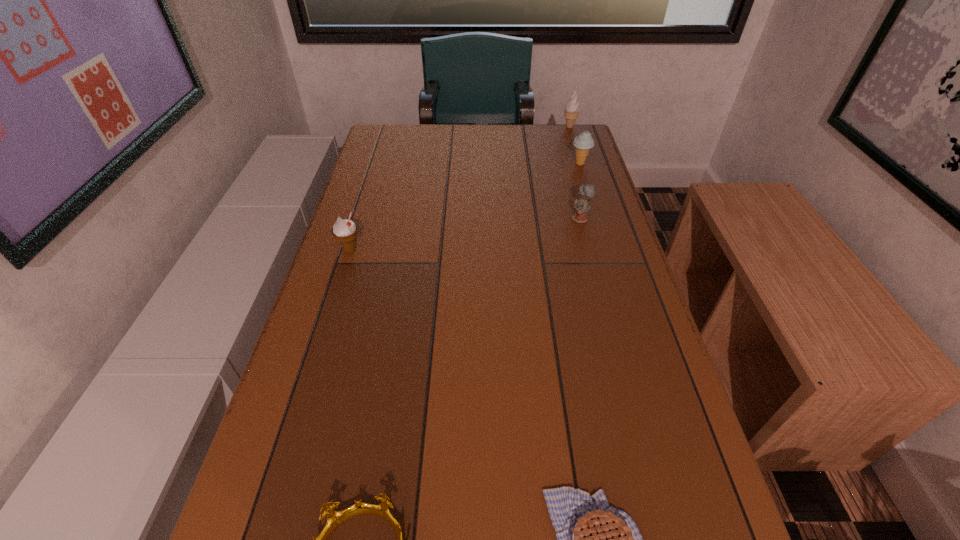
At what (x,y) coordinates should I click in order to perform the action: click on vacant region at the right edge of the desktop. Please return your answer as a coordinate pair (x, y). The image size is (960, 540). Looking at the image, I should click on (655, 429).

The image size is (960, 540). I want to click on blank area at the far left corner, so click(x=375, y=139).

You are a GUI agent. You are given a task and a screenshot of the screen. Output one action in this format:
    pyautogui.click(x=<x>, y=<y>)
    Task: Click on the vacant space that's between the leftmost icecream and the second farthest object
    The width and height of the screenshot is (960, 540).
    Given the screenshot: What is the action you would take?
    pyautogui.click(x=465, y=207)

Identify the location of unoccupied area between the fifth nearest object and the nearest icecream. (465, 207).

This screenshot has width=960, height=540. Find the location of `the third closest object to the pie`. the third closest object to the pie is located at coordinates (344, 230).

Locate an element on the screen. The width and height of the screenshot is (960, 540). the closest object to the nearest icecream is located at coordinates (581, 205).

Point out which icecream is positioned as the second nearest to the shortest object. Please provide its 2D coordinates. Your answer should be formatted as a tuple, i.e. [(x, y)], where the tuple contains the x and y coordinates of a point satisfying the conditions above.

[(584, 142)]

Locate which icecream is the second closest to the second farthest object. Please provide its 2D coordinates. Your answer should be formatted as a tuple, i.e. [(x, y)], where the tuple contains the x and y coordinates of a point satisfying the conditions above.

[(344, 230)]